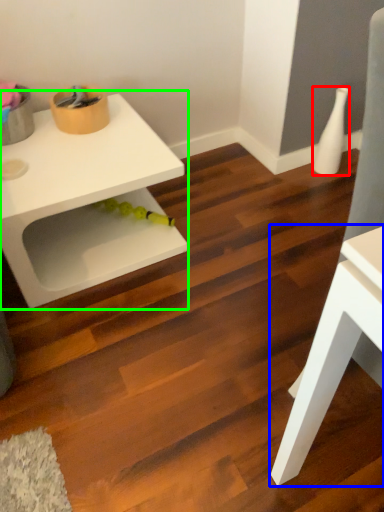
Question: Estimate the real-world distances between objects in this image. Which object is closer to vase (highlighted by a red box), table (highlighted by a blue box) or table (highlighted by a green box)?

Choices:
 (A) table
 (B) table

Answer: (B)